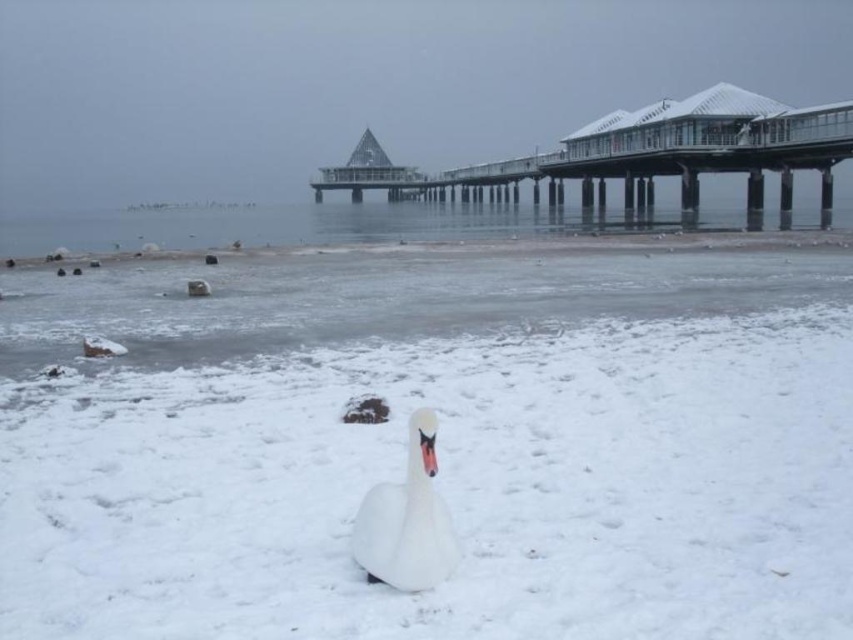
Question: Where is clear ice water at center located in relation to white matte swan at center in the image?

Choices:
 (A) below
 (B) above

Answer: (B)

Question: Can you confirm if clear glass pier at upper center is thinner than white matte swan at center?

Choices:
 (A) no
 (B) yes

Answer: (A)

Question: Among these points, which one is farthest from the camera?

Choices:
 (A) (209, 228)
 (B) (361, 545)
 (C) (743, 131)

Answer: (C)

Question: Which point is farther to the camera?

Choices:
 (A) clear glass pier at upper center
 (B) white matte swan at center
 (C) clear ice water at center

Answer: (A)

Question: From the image, what is the correct spatial relationship of clear glass pier at upper center in relation to white matte swan at center?

Choices:
 (A) left
 (B) right

Answer: (B)

Question: Which object is the farthest from the clear glass pier at upper center?

Choices:
 (A) clear ice water at center
 (B) white matte swan at center

Answer: (B)